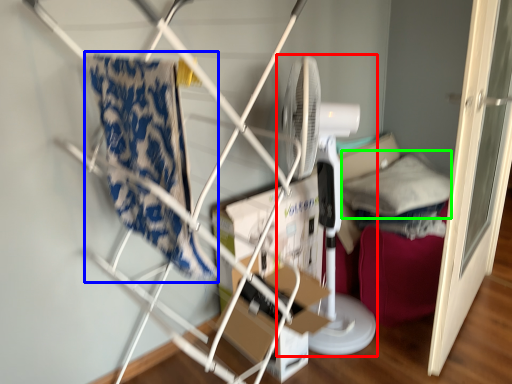
Question: Which object is the closest to the mechanical fan (highlighted by a red box)? Choose among these: beach towel (highlighted by a blue box) or pillow (highlighted by a green box).

Choices:
 (A) beach towel
 (B) pillow

Answer: (B)